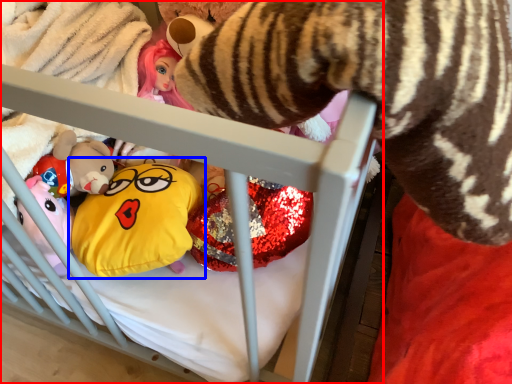
Question: Which object is further to the camera taking this photo, infant bed (highlighted by a red box) or toy (highlighted by a blue box)?

Choices:
 (A) infant bed
 (B) toy

Answer: (B)